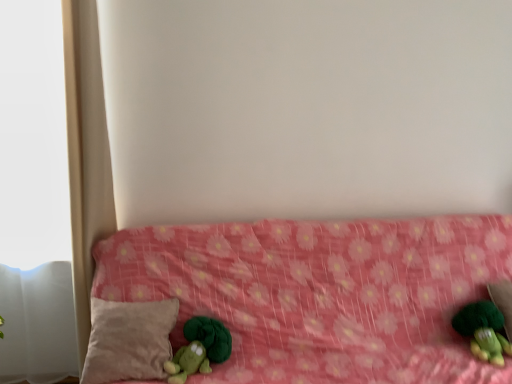
Locate an element on the screen. Image resolution: width=512 pixels, height=384 pixels. blank space situated above beige soft pillow at lower left (from a real-world perspective) is located at coordinates click(130, 296).